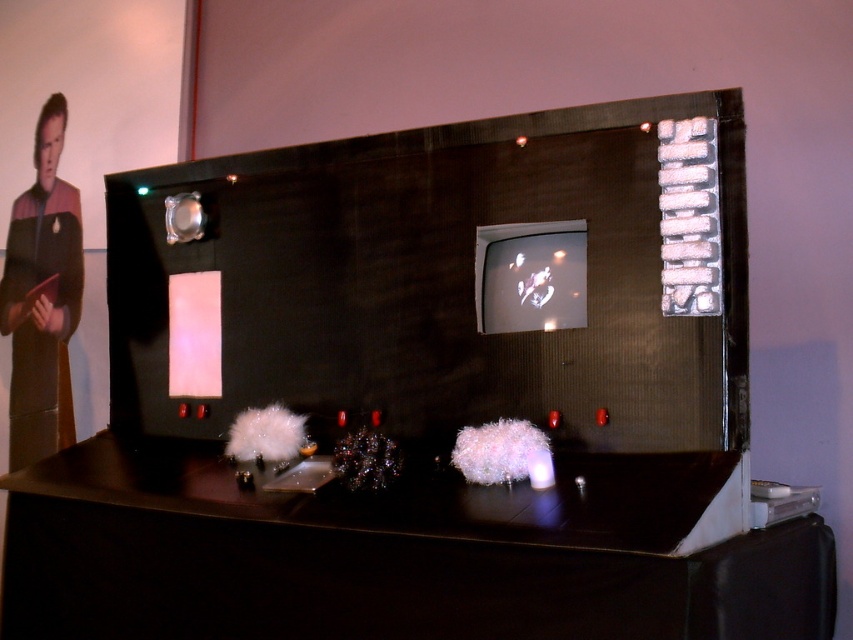
From the picture: Does dark wood table at center have a lesser height compared to uniform fabric man at left?

Yes.

Which is more to the right, dark wood table at center or uniform fabric man at left?

dark wood table at center is more to the right.

Is point (724, 540) closer to camera compared to point (39, 385)?

Yes, it is in front of point (39, 385).

I want to click on dark wood table at center, so click(x=399, y=554).